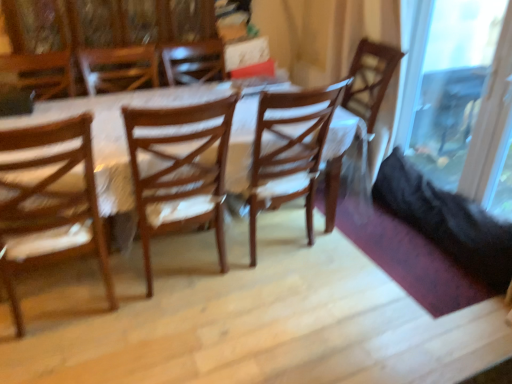
Question: In terms of size, does wooden chair at center, the second chair viewed from the left, appear bigger or smaller than wooden chair at left, the first chair in the left-to-right sequence?

Choices:
 (A) small
 (B) big

Answer: (A)

Question: From a real-world perspective, is wooden chair at center, the second chair in the right-to-left sequence, physically located above or below wooden chair at left, acting as the third chair starting from the right?

Choices:
 (A) above
 (B) below

Answer: (A)

Question: Which of these objects is positioned closest to the wooden chair at center, the second chair viewed from the left?

Choices:
 (A) wooden chair at left, the first chair in the left-to-right sequence
 (B) transparent glass door at right
 (C) wooden chair at center, which is counted as the first chair, starting from the right

Answer: (A)

Question: Which object is positioned closest to the wooden chair at center, which is counted as the first chair, starting from the right?

Choices:
 (A) wooden chair at left, the first chair in the left-to-right sequence
 (B) transparent glass door at right
 (C) wooden chair at center, the second chair in the right-to-left sequence

Answer: (B)